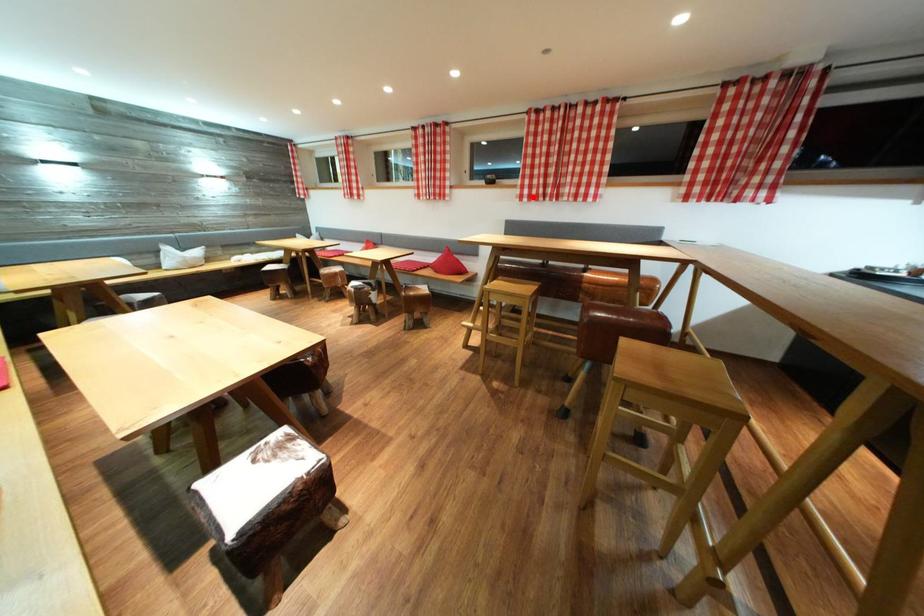
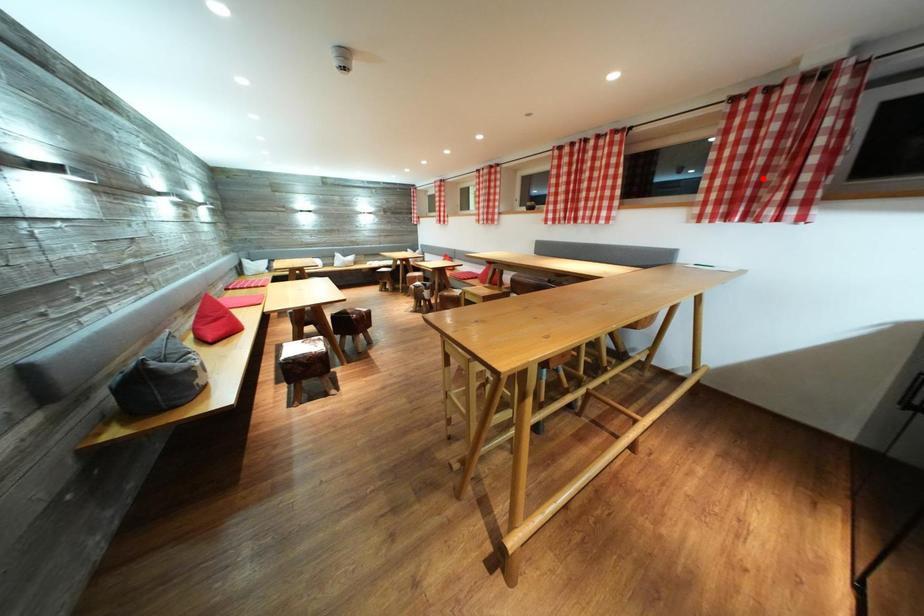
I am providing you with two images of the same scene from different viewpoints. A red point is marked on the first image and another point is marked on the second image. Do the highlighted points in image1 and image2 indicate the same real-world spot?

No